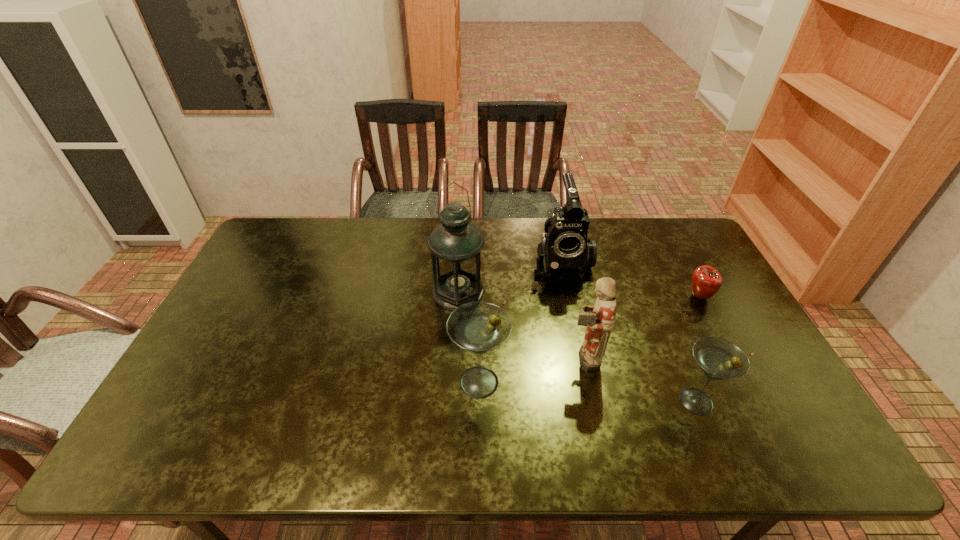
This screenshot has width=960, height=540. Identify the location of blank area located on the lens mount of the camcorder. (585, 380).

Where is `blank space located 0.190m on the left of the rightmost object`? The image size is (960, 540). blank space located 0.190m on the left of the rightmost object is located at coordinates (625, 296).

This screenshot has height=540, width=960. Identify the location of free space located on the front-facing side of the figurine. (509, 357).

Where is `vacant space located on the front-facing side of the figurine`? vacant space located on the front-facing side of the figurine is located at coordinates (439, 357).

Identify the location of blank space located on the front-facing side of the figurine. (453, 357).

Where is `free space located on the right of the tallest object`? This screenshot has height=540, width=960. free space located on the right of the tallest object is located at coordinates (599, 292).

Identify the location of object located in the far edge section of the desktop. The height and width of the screenshot is (540, 960). (566, 251).

Identify the location of object at the right edge. (706, 281).

Where is `vacant space at the far edge of the desktop`? The height and width of the screenshot is (540, 960). vacant space at the far edge of the desktop is located at coordinates (360, 240).

Where is `free location at the near edge of the desktop`? Image resolution: width=960 pixels, height=540 pixels. free location at the near edge of the desktop is located at coordinates (556, 394).